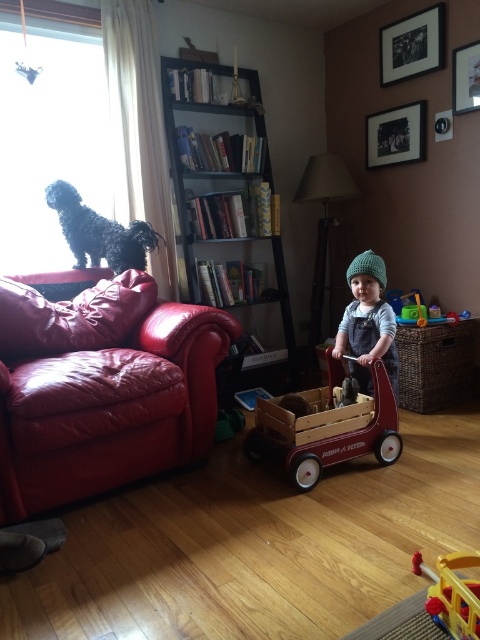
Is point (387, 36) more distant than point (458, 582)?

Yes, point (387, 36) is farther from viewer.

This screenshot has width=480, height=640. Describe the element at coordinates (411, 45) in the screenshot. I see `metallic silver picture frame at upper right` at that location.

In order to click on metallic silver picture frame at upper right in this screenshot , I will do `click(411, 45)`.

Does wooden wagon at center appear over black fluffy dog at left?

No.

Is wooden wagon at center positioned before black fluffy dog at left?

Yes.

Who is more distant from viewer, (340, 380) or (156, 243)?

The point (156, 243) is more distant.

Identify the location of wooden wagon at center. (325, 428).

Does wooden picture frame at upper right appear over translucent plastic toy at center?

Yes.

Is point (465, 90) farther from camera compared to point (394, 310)?

No.

Locate an element on the screen. This screenshot has height=640, width=480. wooden picture frame at upper right is located at coordinates (466, 77).